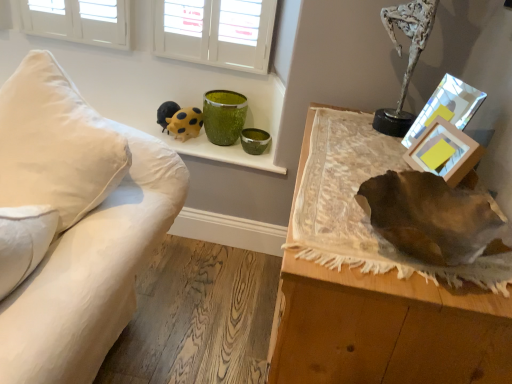
In order to face wooden picture frame at upper right, acting as the 2th picture frame starting from the back, should I rotate leftwards or rightwards?

It's best to rotate right around 23.548 degrees.

What is the approximate width of white fabric couch at left?

The width of white fabric couch at left is 3.34 feet.

The image size is (512, 384). In order to click on yellow dotted plush at upper center in this screenshot , I will do `click(185, 123)`.

Is green speckled glass vase at upper center located outside yellow dotted plush at upper center?

Absolutely, green speckled glass vase at upper center is external to yellow dotted plush at upper center.

Identify the location of vase lying in front of the yellow dotted plush at upper center. The width and height of the screenshot is (512, 384). (224, 116).

Considering the points (212, 140) and (179, 116), which point is in front, point (212, 140) or point (179, 116)?

Positioned in front is point (212, 140).

Which of these two, green speckled glass vase at upper center or yellow dotted plush at upper center, stands shorter?

With less height is yellow dotted plush at upper center.

Would you say yellow dotted plush at upper center is part of leather at right's contents?

Definitely not — yellow dotted plush at upper center is not inside leather at right.

The height and width of the screenshot is (384, 512). Identify the location of table on the right of yellow dotted plush at upper center. (386, 329).

Is leather at right aimed at yellow dotted plush at upper center?

Yes, leather at right is facing yellow dotted plush at upper center.

Between leather at right and yellow dotted plush at upper center, which one has larger size?

Bigger between the two is leather at right.

At what (x,y) coordinates should I click in order to perform the action: click on table in front of the yellow dotted plush at upper center. Please return your answer as a coordinate pair (x, y). Looking at the image, I should click on (386, 329).

From a real-world perspective, is yellow dotted plush at upper center located beneath leather at right?

No, from a real-world perspective, yellow dotted plush at upper center is not under leather at right.

Would you say yellow dotted plush at upper center is to the left or to the right of leather at right in the picture?

yellow dotted plush at upper center is to the left of leather at right.

Considering the sizes of objects yellow dotted plush at upper center and leather at right in the image provided, who is shorter, yellow dotted plush at upper center or leather at right?

yellow dotted plush at upper center.

Between point (73, 156) and point (471, 167), which one is positioned behind?

The point (471, 167) is behind.

Which of these two, white fabric couch at left or wooden picture frame at upper right, acting as the 2th picture frame starting from the back, stands taller?

With more height is white fabric couch at left.

Starting from the white fabric couch at left, which picture frame is the 1st one to the right? Please provide its 2D coordinates.

[(444, 152)]

Is white fabric couch at left positioned with its back to wooden picture frame at upper right, acting as the 1th picture frame starting from the front?

No, wooden picture frame at upper right, acting as the 1th picture frame starting from the front, is not at the back of white fabric couch at left.

Is green speckled glass vase at upper center located outside wooden picture frame at upper right, acting as the 1th picture frame starting from the front?

green speckled glass vase at upper center is positioned outside wooden picture frame at upper right, acting as the 1th picture frame starting from the front.

Between green speckled glass vase at upper center and wooden picture frame at upper right, acting as the 1th picture frame starting from the front, which one has smaller size?

With smaller size is wooden picture frame at upper right, acting as the 1th picture frame starting from the front.

Considering the sizes of objects green speckled glass vase at upper center and wooden picture frame at upper right, acting as the 2th picture frame starting from the back, in the image provided, who is taller, green speckled glass vase at upper center or wooden picture frame at upper right, acting as the 2th picture frame starting from the back,?

green speckled glass vase at upper center.

Is leather at right in front of or behind wooden picture frame at upper right, acting as the 1th picture frame starting from the front, in the image?

Visually, leather at right is located in front of wooden picture frame at upper right, acting as the 1th picture frame starting from the front.

What's the angular difference between leather at right and wooden picture frame at upper right, acting as the 1th picture frame starting from the front,'s facing directions?

The angle between the facing direction of leather at right and the facing direction of wooden picture frame at upper right, acting as the 1th picture frame starting from the front, is 18.6 degrees.

Are leather at right and wooden picture frame at upper right, acting as the 1th picture frame starting from the front, far apart?

That's not correct — leather at right is a little close to wooden picture frame at upper right, acting as the 1th picture frame starting from the front.

From the picture: Considering the sizes of objects leather at right and wooden picture frame at upper right, acting as the 2th picture frame starting from the back, in the image provided, who is bigger, leather at right or wooden picture frame at upper right, acting as the 2th picture frame starting from the back,?

Bigger between the two is leather at right.

Is white fabric couch at left to the left or to the right of yellow dotted plush at upper center in the image?

In the image, white fabric couch at left appears on the left side of yellow dotted plush at upper center.

In the scene shown: Are white fabric couch at left and yellow dotted plush at upper center making contact?

No, white fabric couch at left is not making contact with yellow dotted plush at upper center.

Considering the relative sizes of white fabric couch at left and yellow dotted plush at upper center in the image provided, is white fabric couch at left wider than yellow dotted plush at upper center?

Indeed, white fabric couch at left has a greater width compared to yellow dotted plush at upper center.

Considering the sizes of white fabric couch at left and yellow dotted plush at upper center in the image, is white fabric couch at left taller or shorter than yellow dotted plush at upper center?

In the image, white fabric couch at left appears to be taller than yellow dotted plush at upper center.

Where is `vase that is above the yellow dotted plush at upper center (from the image's perspective)`? The image size is (512, 384). vase that is above the yellow dotted plush at upper center (from the image's perspective) is located at coordinates (224, 116).

Locate an element on the screen. Image resolution: width=512 pixels, height=384 pixels. table in front of the yellow dotted plush at upper center is located at coordinates (386, 329).

Based on their spatial positions, is white fabric couch at left or green speckled glass vase at upper center closer to yellow dotted plush at upper center?

The object closer to yellow dotted plush at upper center is green speckled glass vase at upper center.

Estimate the real-world distances between objects in this image. Which object is closer to white fabric couch at left, yellow dotted plush at upper center or leather at right?

Based on the image, leather at right appears to be nearer to white fabric couch at left.

Based on their spatial positions, is wooden picture frame at upper right, acting as the 2th picture frame starting from the back, or metallic reflective frame at upper right, which appears as the 1th picture frame when viewed from the back, further from leather at right?

metallic reflective frame at upper right, which appears as the 1th picture frame when viewed from the back.

Estimate the real-world distances between objects in this image. Which object is closer to wooden picture frame at upper right, acting as the 1th picture frame starting from the front, green speckled glass vase at upper center or leather at right?

Based on the image, leather at right appears to be nearer to wooden picture frame at upper right, acting as the 1th picture frame starting from the front.

Estimate the real-world distances between objects in this image. Which object is further from yellow dotted plush at upper center, metallic reflective frame at upper right, the 2th picture frame from the front, or white fabric couch at left?

Based on the image, metallic reflective frame at upper right, the 2th picture frame from the front, appears to be further to yellow dotted plush at upper center.

Looking at the image, which one is located closer to leather at right, green speckled glass vase at upper center or yellow dotted plush at upper center?

green speckled glass vase at upper center.

Considering their positions, is white fabric couch at left positioned further to green speckled glass vase at upper center than yellow dotted plush at upper center?

white fabric couch at left is positioned further to the anchor green speckled glass vase at upper center.

From the picture: Considering their positions, is green speckled glass vase at upper center positioned closer to metallic reflective frame at upper right, the 2th picture frame from the front, than yellow dotted plush at upper center?

green speckled glass vase at upper center lies closer to metallic reflective frame at upper right, the 2th picture frame from the front, than the other object.

Image resolution: width=512 pixels, height=384 pixels. In order to click on vase situated between white fabric couch at left and metallic reflective frame at upper right, the 2th picture frame from the front, from left to right in this screenshot , I will do `click(224, 116)`.

This screenshot has width=512, height=384. In order to click on vase located between leather at right and yellow dotted plush at upper center in the depth direction in this screenshot , I will do `click(224, 116)`.

Locate an element on the screen. This screenshot has width=512, height=384. table between white fabric couch at left and yellow dotted plush at upper center from front to back is located at coordinates (386, 329).

Locate an element on the screen. The width and height of the screenshot is (512, 384). vase between yellow dotted plush at upper center and metallic reflective frame at upper right, which appears as the 1th picture frame when viewed from the back is located at coordinates (224, 116).